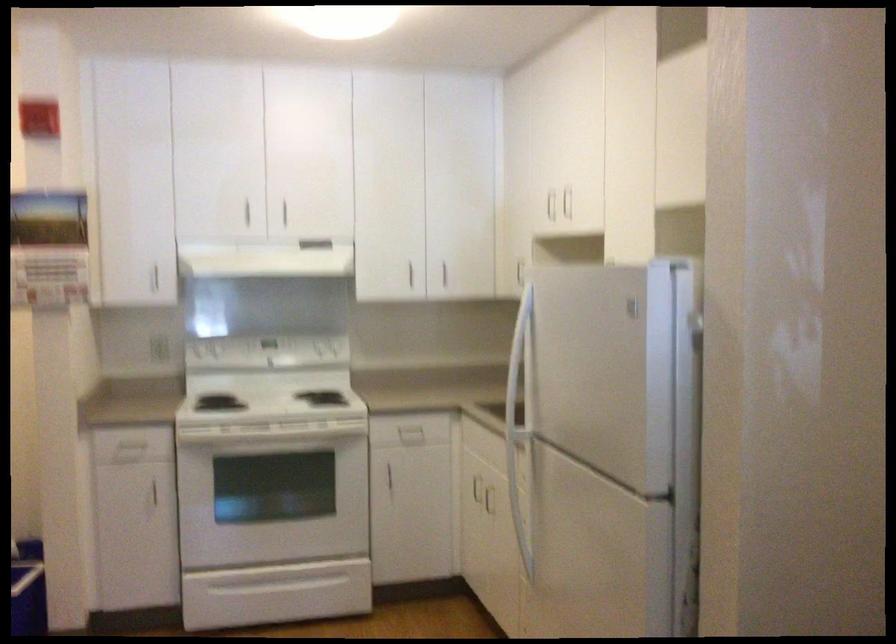
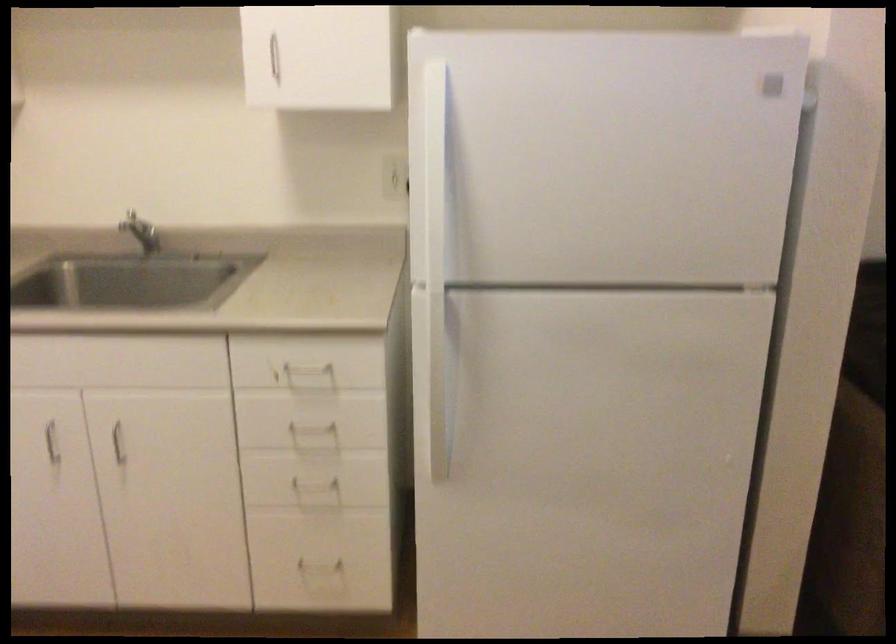
Find the pixel in the second image that matches pixel 515 408 in the first image.

(435, 261)